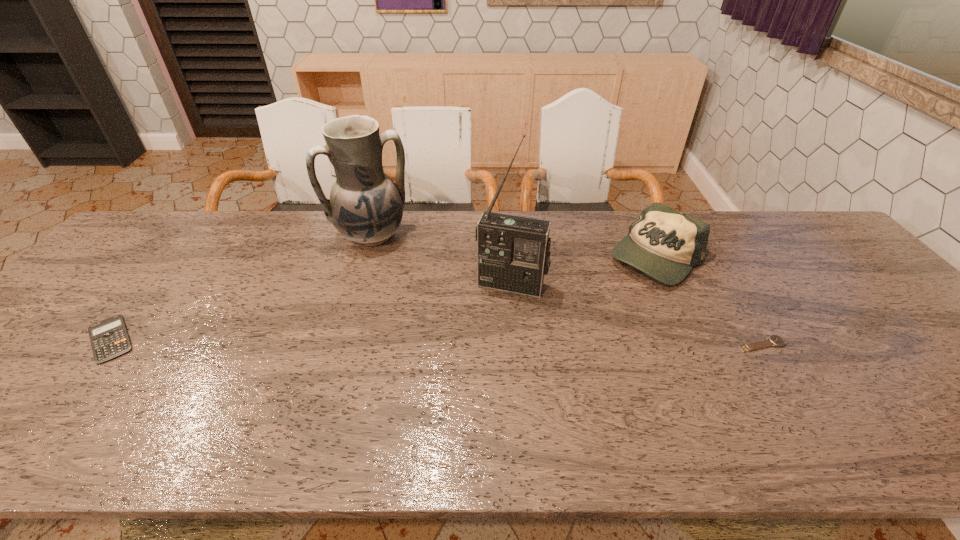
The height and width of the screenshot is (540, 960). In order to click on vacant region between the radio receiver and the third tallest object in this screenshot , I will do `click(584, 271)`.

I want to click on vacant space in between the leftmost object and the watch, so click(x=437, y=342).

Where is `free space that is in between the leftmost object and the third shortest object`? The image size is (960, 540). free space that is in between the leftmost object and the third shortest object is located at coordinates (383, 298).

You are a GUI agent. You are given a task and a screenshot of the screen. Output one action in this format:
    pyautogui.click(x=<x>, y=<y>)
    Task: Click on the vacant space in between the calculator and the third object from left to right
    This screenshot has height=540, width=960.
    Given the screenshot: What is the action you would take?
    pyautogui.click(x=311, y=312)

You are a GUI agent. You are given a task and a screenshot of the screen. Output one action in this format:
    pyautogui.click(x=<x>, y=<y>)
    Task: Click on the free space between the third tallest object and the watch
    
    Given the screenshot: What is the action you would take?
    pyautogui.click(x=708, y=301)

Where is `object that is the fourth closest to the baseball cap`? The width and height of the screenshot is (960, 540). object that is the fourth closest to the baseball cap is located at coordinates (109, 338).

Select which object is the fourth closest to the radio receiver. Please provide its 2D coordinates. Your answer should be formatted as a tuple, i.e. [(x, y)], where the tuple contains the x and y coordinates of a point satisfying the conditions above.

[(109, 338)]

Find the location of a particular element. This screenshot has width=960, height=540. free space that satisfies the following two spatial constraints: 1. on the back side of the third object from left to right; 2. on the right side of the calculator is located at coordinates (156, 285).

The width and height of the screenshot is (960, 540). What are the coordinates of `vacant region that satisfies the following two spatial constraints: 1. on the front side of the third shortest object; 2. on the left side of the fourth shortest object` in the screenshot? It's located at (365, 258).